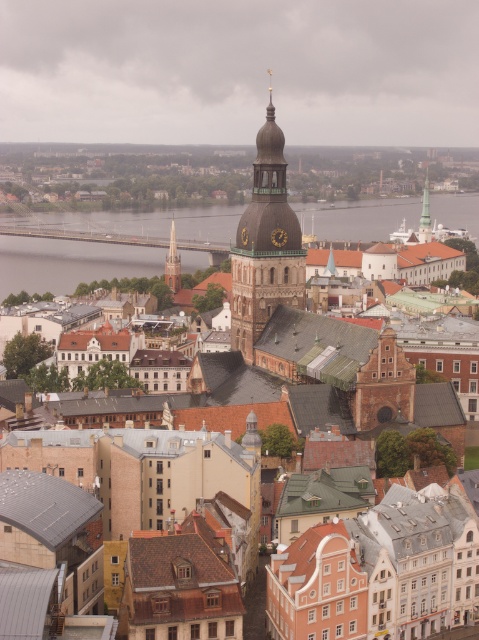
You are a tourist standing in the square in front of the gold textured clock tower at center and the green copper spire at upper center. Which one would you see first as you look up from the ground?

The gold textured clock tower at center is closer to the viewer than the green copper spire at upper center, so you would see the gold textured clock tower at center first when looking up.

You are standing in the historic cityscape of Riga, Latvia, looking at the Dome Cathedral. You notice two points marked in the scene. Which point, point (79, 280) or point (178, 260), is closer to you?

Point (79, 280) is closer to you because it is further to the viewer than point (178, 260).

You are a tourist standing in the middle of the historic city of Riga, Latvia. You notice the gold textured clock tower at center and the smooth silver spire at center. Which one of these two structures is taller?

The gold textured clock tower at center is taller than the smooth silver spire at center.